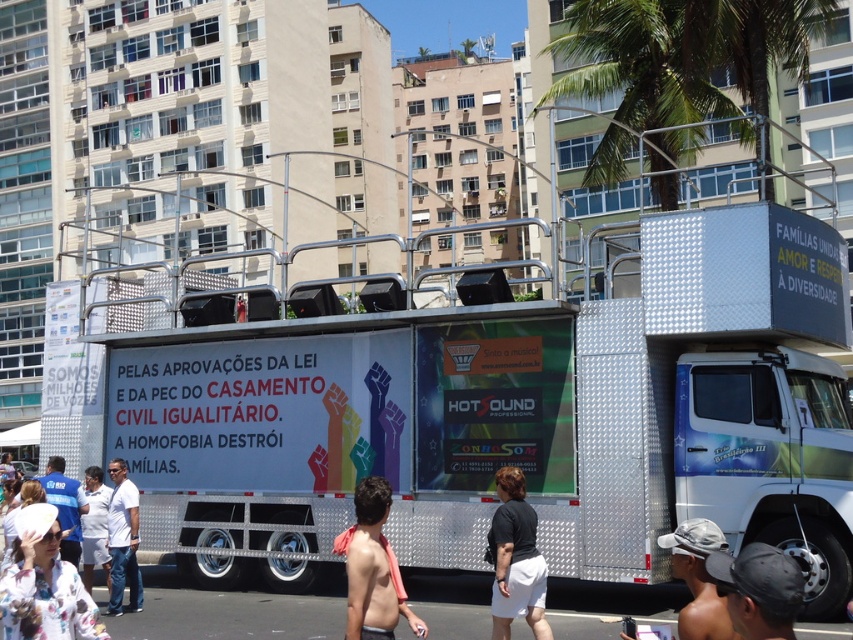
Question: Among these objects, which one is farthest from the camera?

Choices:
 (A) black fabric skirt at lower center
 (B) skinny white skin at center

Answer: (A)

Question: Which of the following is the farthest from the observer?

Choices:
 (A) skinny white skin at center
 (B) green leafy palm tree at upper center
 (C) floral fabric shirt at lower left

Answer: (B)

Question: Does skinny white skin at center have a smaller size compared to blue shirt at lower left?

Choices:
 (A) yes
 (B) no

Answer: (A)

Question: Can you confirm if white fabric shirt at lower left is wider than blue shirt at lower left?

Choices:
 (A) no
 (B) yes

Answer: (A)

Question: Which point is farther to the camera?

Choices:
 (A) (527, 588)
 (B) (770, 560)
 (C) (585, 32)

Answer: (C)

Question: Can you confirm if floral fabric shirt at lower left is thinner than white matte shirt at center?

Choices:
 (A) yes
 (B) no

Answer: (B)